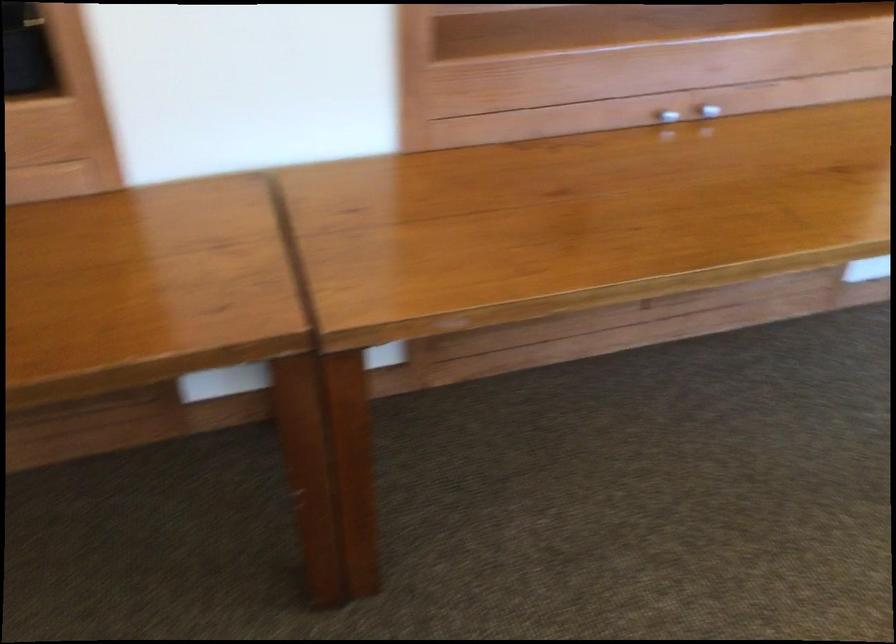
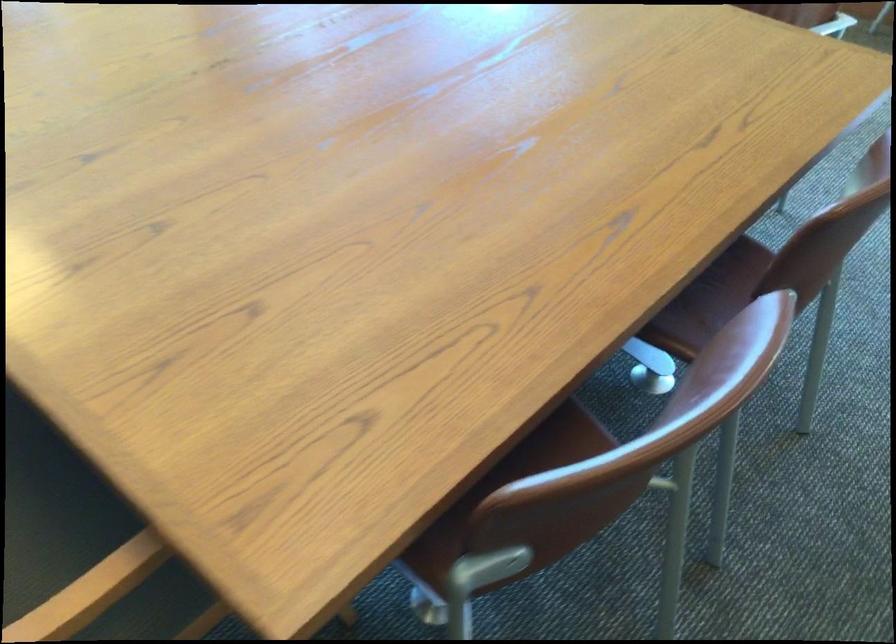
The first image is from the beginning of the video and the second image is from the end. How did the camera likely rotate when shooting the video?

The camera rotated toward right-down.